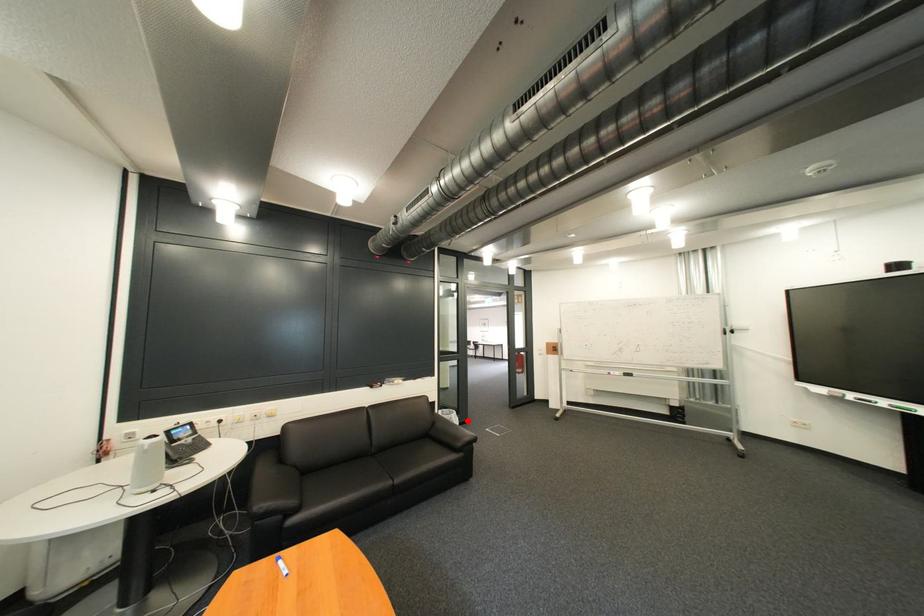
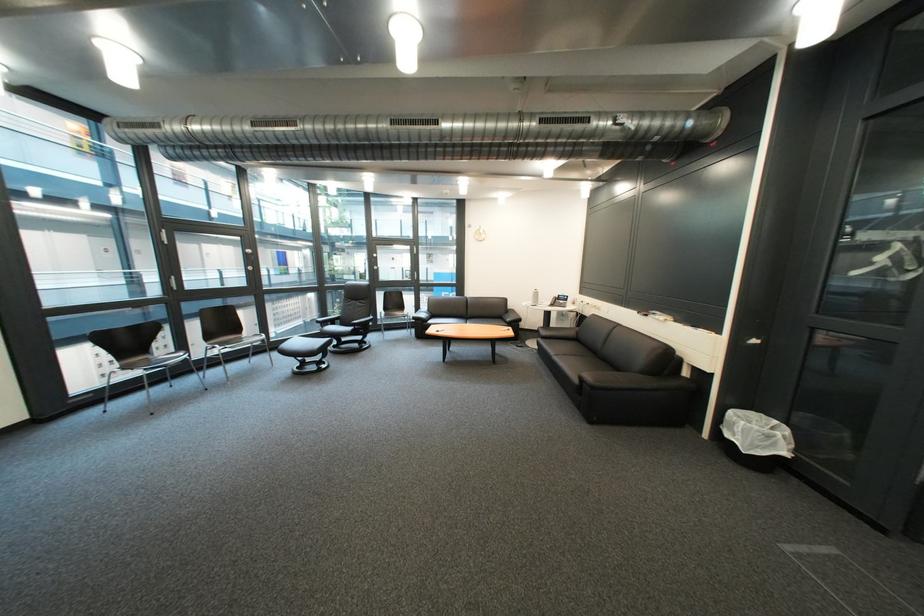
In the second image, find the point that corresponds to the highlighted location in the first image.

(751, 431)